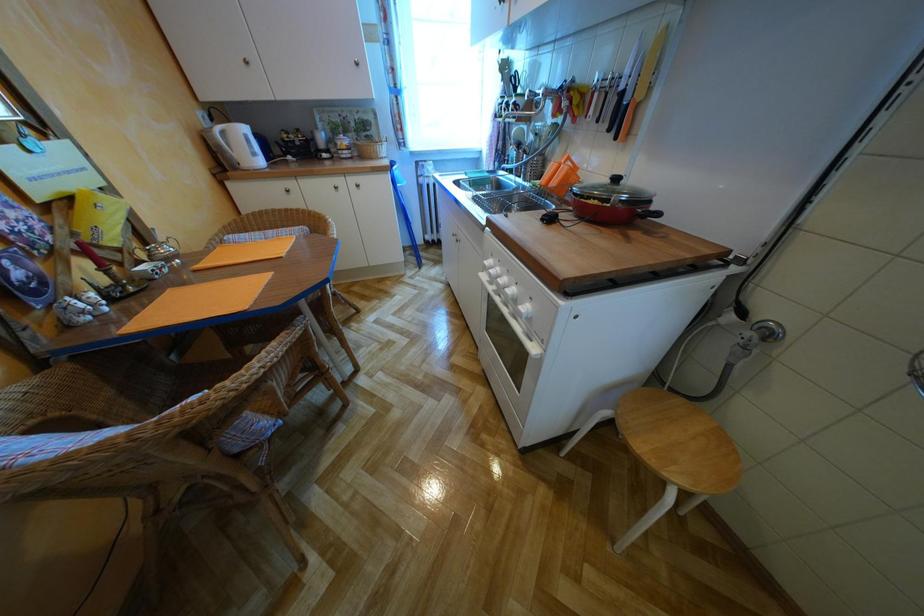
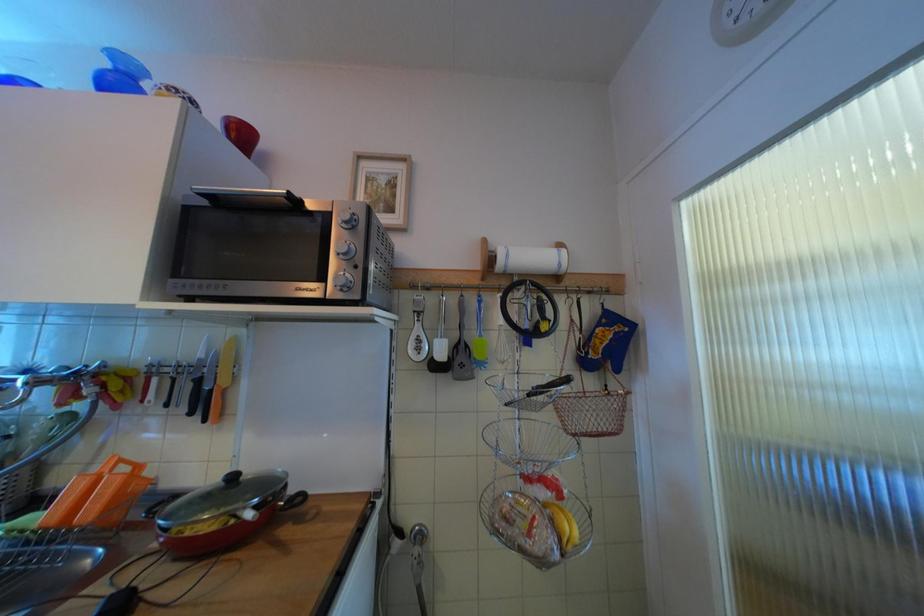
Question: The camera is either moving clockwise (left) or counter-clockwise (right) around the object. The first image is from the beginning of the video and the second image is from the end. Is the camera moving left or right when shooting the video?

Choices:
 (A) Left
 (B) Right

Answer: (A)